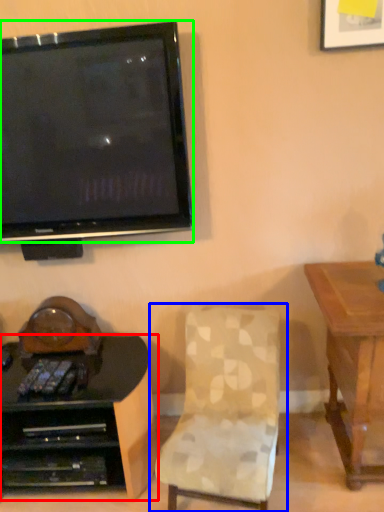
Question: Considering the real-world distances, which object is farthest from desk (highlighted by a red box)? chair (highlighted by a blue box) or television (highlighted by a green box)?

Choices:
 (A) chair
 (B) television

Answer: (B)